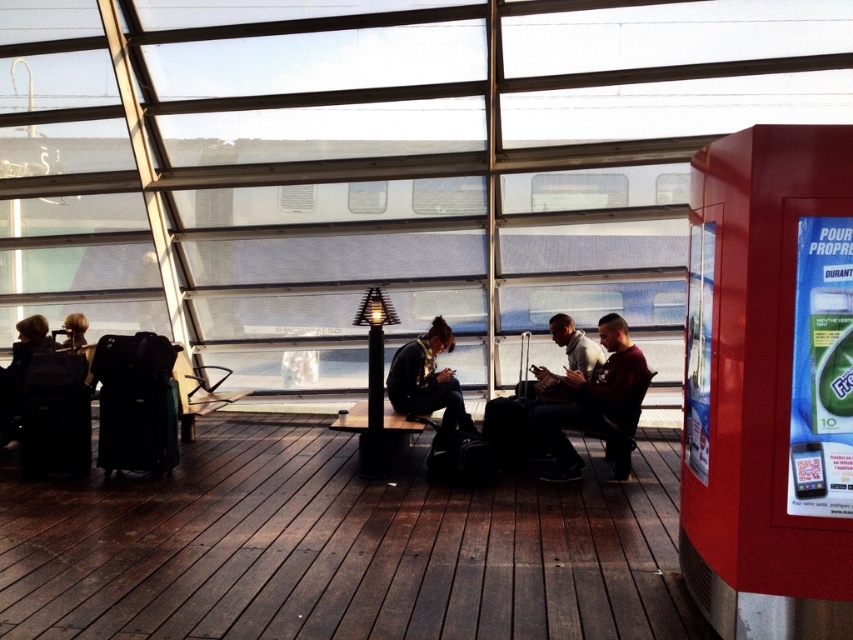
You are standing at the entrance of the waiting area and want to find the dark brown leather jacket at center. Which direction should you walk to reach it?

The dark brown leather jacket at center is located at point 0.625 on the x axis and 0.696 on the y axis. Since you are at the entrance, you should walk towards the center of the waiting area to reach it.

You are a delivery person carrying a package that is 10 feet long. You need to move it from the matte black suitcase at left to the metallic red vending machine at right. Is there enough space to maneuver the package without tilting it sideways?

The distance between the metallic red vending machine at right and the matte black suitcase at left is 18.72 feet. Since the package is 10 feet long, there is sufficient space to move it without tilting sideways.

You are a traveler who just arrived at the station and need to place your dark brown leather jacket at center on the seat of the metallic gray chair at center. Can the jacket fit on the chair seat without any part hanging off?

The dark brown leather jacket at center is smaller than the metallic gray chair at center, so it can fit on the chair seat without any part hanging off.